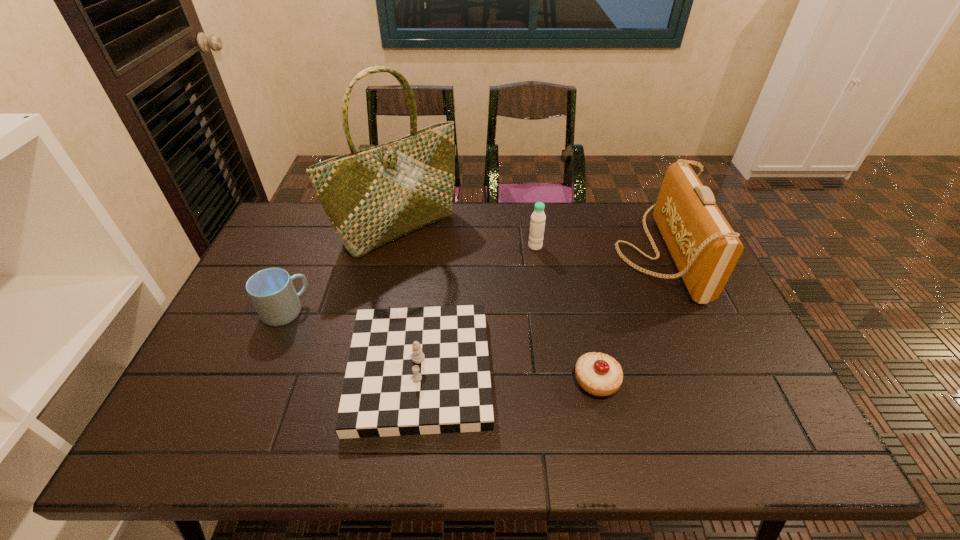
The width and height of the screenshot is (960, 540). Find the location of `vacant region located on the decorative side of the rightmost object`. vacant region located on the decorative side of the rightmost object is located at coordinates (556, 252).

The width and height of the screenshot is (960, 540). In order to click on vacant space located 0.370m on the decorative side of the rightmost object in this screenshot , I will do `click(499, 252)`.

The width and height of the screenshot is (960, 540). Find the location of `vacant space located 0.320m on the decorative side of the rightmost object`. vacant space located 0.320m on the decorative side of the rightmost object is located at coordinates (516, 252).

The image size is (960, 540). Identify the location of vacant space situated 0.060m on the left of the third tallest object. (510, 246).

Locate an element on the screen. vacant space located on the front of the mug is located at coordinates (273, 343).

Find the location of a particular element. This screenshot has height=540, width=960. free region located on the right of the checkerboard is located at coordinates (589, 370).

You are a GUI agent. You are given a task and a screenshot of the screen. Output one action in this format:
    pyautogui.click(x=<x>, y=<y>)
    Task: Click on the vacant space situated 0.140m on the right of the shortest object
    The image size is (960, 540).
    Given the screenshot: What is the action you would take?
    pyautogui.click(x=677, y=381)

You are a GUI agent. You are given a task and a screenshot of the screen. Output one action in this format:
    pyautogui.click(x=<x>, y=<y>)
    Task: Click on the shopping bag at the far edge
    The width and height of the screenshot is (960, 540).
    Given the screenshot: What is the action you would take?
    pyautogui.click(x=373, y=196)

Identify the location of handbag that is at the far edge. (705, 248).

This screenshot has width=960, height=540. What are the coordinates of `water bottle present at the far edge` in the screenshot? It's located at (537, 225).